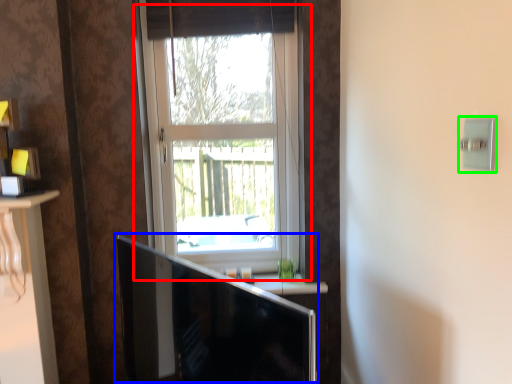
Question: Which is nearer to the window (highlighted by a red box)? computer monitor (highlighted by a blue box) or light switch (highlighted by a green box).

Choices:
 (A) computer monitor
 (B) light switch

Answer: (A)